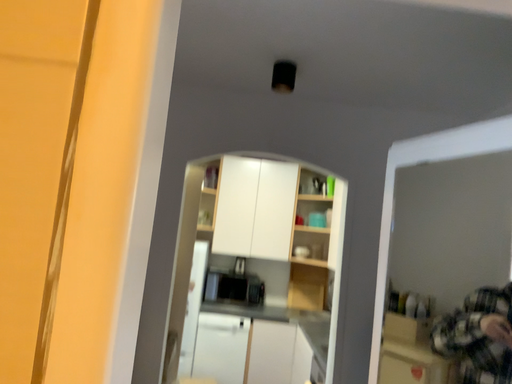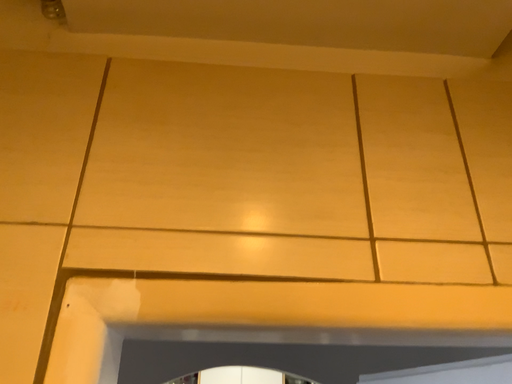
Question: Which way did the camera rotate in the video?

Choices:
 (A) rotated downward
 (B) rotated upward

Answer: (B)